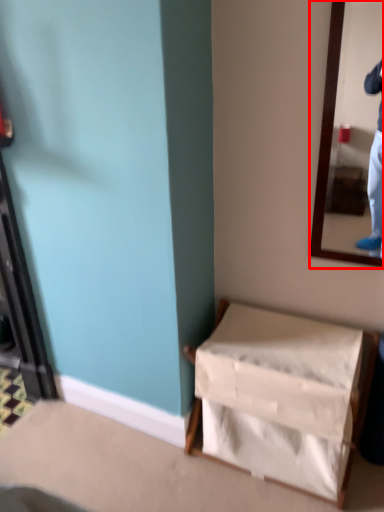
Question: From the image's perspective, what is the correct spatial positioning of mirror (annotated by the red box) in reference to furniture?

Choices:
 (A) below
 (B) above

Answer: (B)